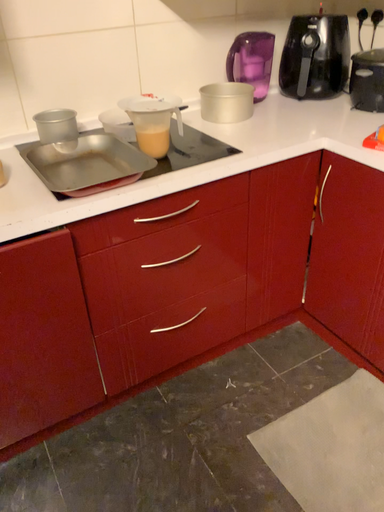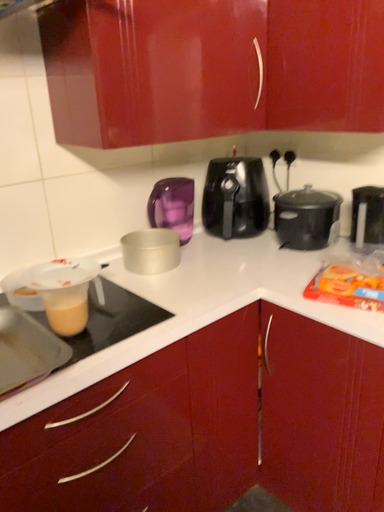
Question: How did the camera likely rotate when shooting the video?

Choices:
 (A) rotated downward
 (B) rotated upward

Answer: (B)